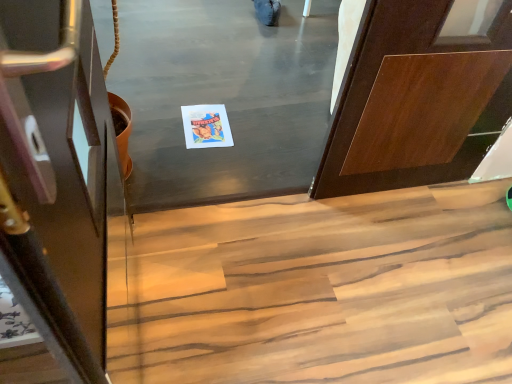
Question: Is wooden stairs at lower center bigger or smaller than shiny dark wood door at left?

Choices:
 (A) small
 (B) big

Answer: (B)

Question: Considering the relative positions of wooden stairs at lower center and shiny dark wood door at left in the image provided, is wooden stairs at lower center to the left or to the right of shiny dark wood door at left?

Choices:
 (A) right
 (B) left

Answer: (A)

Question: Estimate the real-world distances between objects in this image. Which object is closer to the shiny dark wood door at left?

Choices:
 (A) matte paper postcard at center
 (B) wooden stairs at lower center

Answer: (B)

Question: Which is farther from the wooden stairs at lower center?

Choices:
 (A) shiny dark wood door at left
 (B) matte paper postcard at center

Answer: (A)